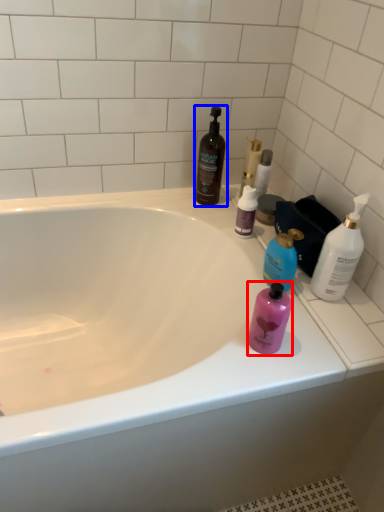
Question: Which object appears closest to the camera in this image, bottle (highlighted by a red box) or bottle (highlighted by a blue box)?

Choices:
 (A) bottle
 (B) bottle

Answer: (A)